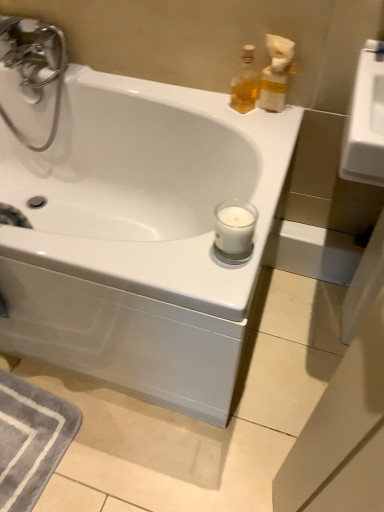
This screenshot has height=512, width=384. I want to click on vacant space in front of translucent plastic soap dispenser at upper right, acting as the 2th soap dispenser starting from the left, so click(x=273, y=133).